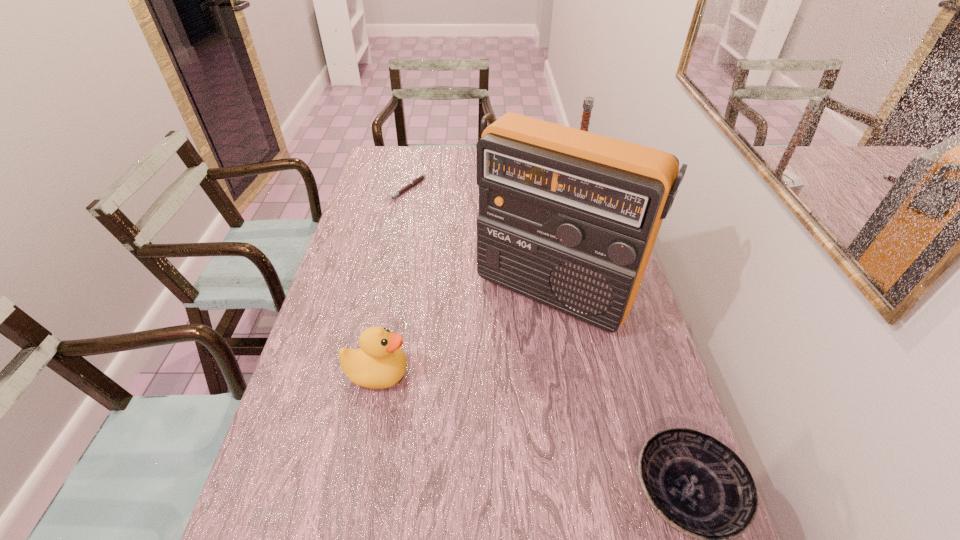
Where is `the second nearest object`? The width and height of the screenshot is (960, 540). the second nearest object is located at coordinates (380, 363).

The image size is (960, 540). Identify the location of the third shortest object. (380, 363).

Locate an element on the screen. This screenshot has height=540, width=960. the third nearest object is located at coordinates (568, 218).

What are the coordinates of `the tallest object` in the screenshot? It's located at pyautogui.click(x=568, y=218).

Where is `hammer`? hammer is located at coordinates (588, 103).

In order to click on pen in this screenshot , I will do `click(419, 178)`.

The height and width of the screenshot is (540, 960). Identify the location of blank area located at the beak of the second nearest object. [538, 374].

The height and width of the screenshot is (540, 960). I want to click on vacant space located on the front-facing side of the tallest object, so click(x=431, y=453).

Locate an element on the screen. The height and width of the screenshot is (540, 960). free space located on the front-facing side of the tallest object is located at coordinates (506, 347).

You are a GUI agent. You are given a task and a screenshot of the screen. Output one action in this format:
    pyautogui.click(x=<x>, y=<y>)
    Task: Click on the vacant space located on the front-facing side of the tallest object
    
    Given the screenshot: What is the action you would take?
    pyautogui.click(x=482, y=381)